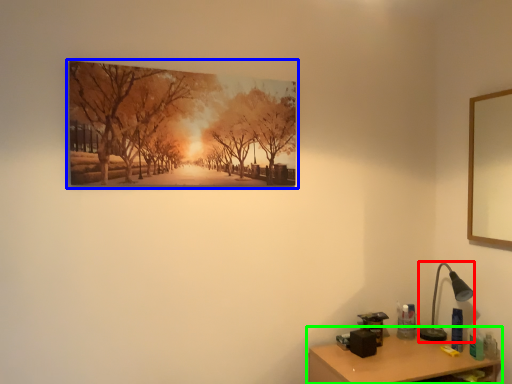
Question: Which object is the farthest from table lamp (highlighted by a red box)? Choose among these: picture frame (highlighted by a blue box) or table (highlighted by a green box).

Choices:
 (A) picture frame
 (B) table

Answer: (A)